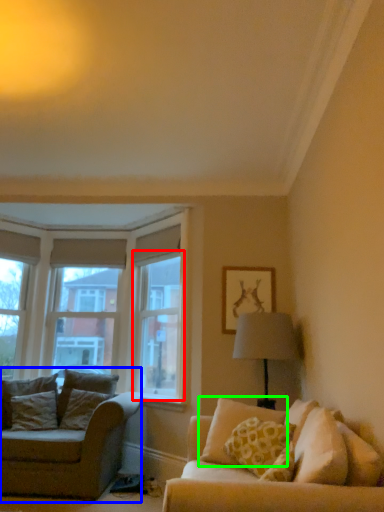
Question: Which object is positioned closest to window screen (highlighted by a red box)? Select from studio couch (highlighted by a blue box) and pillow (highlighted by a green box).

Choices:
 (A) studio couch
 (B) pillow

Answer: (A)